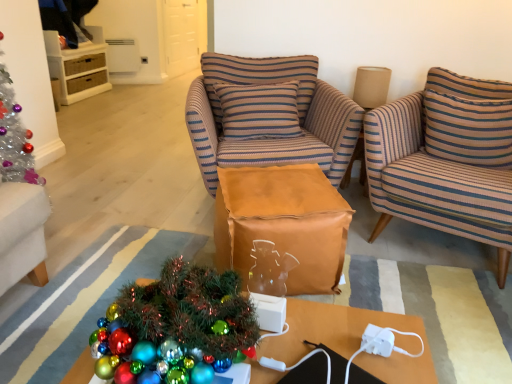
Question: Considering their positions, is brown paper bag at center located in front of or behind brown striped armchair at center, the 1th chair when ordered from left to right?

Choices:
 (A) front
 (B) behind

Answer: (A)

Question: Considering the positions of brown paper bag at center and brown striped armchair at center, the 2th chair in the right-to-left sequence, in the image, is brown paper bag at center bigger or smaller than brown striped armchair at center, the 2th chair in the right-to-left sequence,?

Choices:
 (A) small
 (B) big

Answer: (A)

Question: Which object is positioned closest to the shiny metallic ornaments at lower left?

Choices:
 (A) brown paper bag at center
 (B) shiny metallic desk at lower center
 (C) striped fabric pillow at center, the first pillow from the left
 (D) white wicker cabinet at upper left
 (E) brown striped armchair at center, the 2th chair in the right-to-left sequence

Answer: (B)

Question: Which of these objects is positioned farthest from the brown paper bag at center?

Choices:
 (A) shiny metallic ornaments at lower left
 (B) striped fabric pillow at upper right, which ranks as the first pillow in right-to-left order
 (C) striped fabric armchair at right, placed as the 2th chair when sorted from left to right
 (D) striped fabric pillow at center, arranged as the second pillow when viewed from the right
 (E) shiny metallic desk at lower center

Answer: (B)